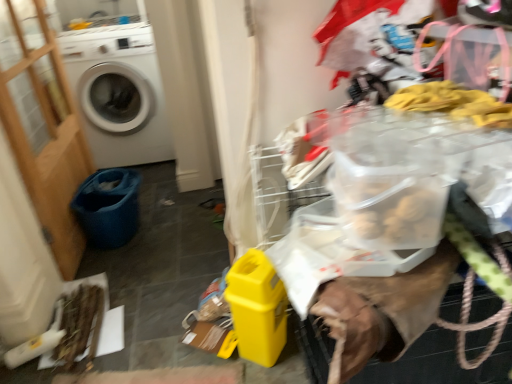
Question: Is wooden screen door at left aimed at white matte washing machine at left?

Choices:
 (A) yes
 (B) no

Answer: (B)

Question: Is white matte washing machine at left at the back of wooden screen door at left?

Choices:
 (A) no
 (B) yes

Answer: (A)

Question: From the image's perspective, is wooden screen door at left under white matte washing machine at left?

Choices:
 (A) no
 (B) yes

Answer: (B)

Question: Does wooden screen door at left come in front of white matte washing machine at left?

Choices:
 (A) no
 (B) yes

Answer: (B)

Question: Is the position of wooden screen door at left more distant than that of white matte washing machine at left?

Choices:
 (A) yes
 (B) no

Answer: (B)

Question: Choose the correct answer: Is wooden screen door at left inside white matte washing machine at left or outside it?

Choices:
 (A) outside
 (B) inside

Answer: (A)

Question: Looking at their shapes, would you say wooden screen door at left is wider or thinner than white matte washing machine at left?

Choices:
 (A) wide
 (B) thin

Answer: (B)

Question: From a real-world perspective, is wooden screen door at left positioned above or below white matte washing machine at left?

Choices:
 (A) below
 (B) above

Answer: (B)

Question: From the image's perspective, is wooden screen door at left positioned above or below white matte washing machine at left?

Choices:
 (A) below
 (B) above

Answer: (A)

Question: Based on their positions, is wooden screen door at left located to the left or right of blue fabric bucket at lower left?

Choices:
 (A) left
 (B) right

Answer: (A)

Question: From their relative heights in the image, would you say wooden screen door at left is taller or shorter than blue fabric bucket at lower left?

Choices:
 (A) tall
 (B) short

Answer: (A)

Question: Is point (38, 99) closer or farther from the camera than point (93, 210)?

Choices:
 (A) closer
 (B) farther

Answer: (B)

Question: From a real-world perspective, is wooden screen door at left positioned above or below blue fabric bucket at lower left?

Choices:
 (A) below
 (B) above

Answer: (B)

Question: In the image, is white matte washing machine at left positioned in front of or behind blue fabric bucket at lower left?

Choices:
 (A) behind
 (B) front

Answer: (A)

Question: From the image's perspective, is white matte washing machine at left positioned above or below blue fabric bucket at lower left?

Choices:
 (A) above
 (B) below

Answer: (A)